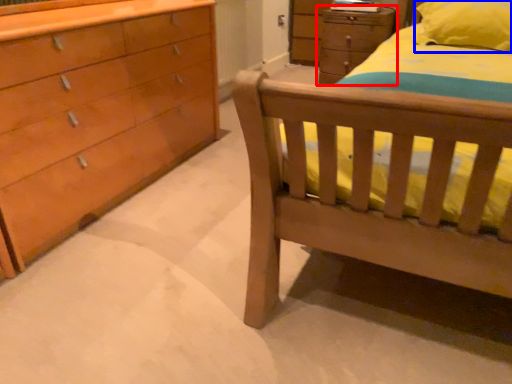
Question: Which of the following is the closest to the observer, chest of drawers (highlighted by a red box) or pillow (highlighted by a blue box)?

Choices:
 (A) chest of drawers
 (B) pillow

Answer: (B)